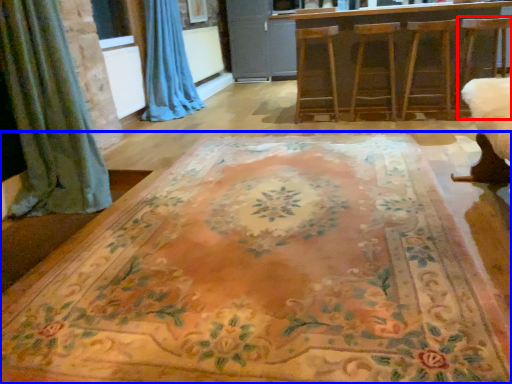
Question: Among these objects, which one is nearest to the camera, swivel chair (highlighted by a red box) or furniture (highlighted by a blue box)?

Choices:
 (A) swivel chair
 (B) furniture

Answer: (B)